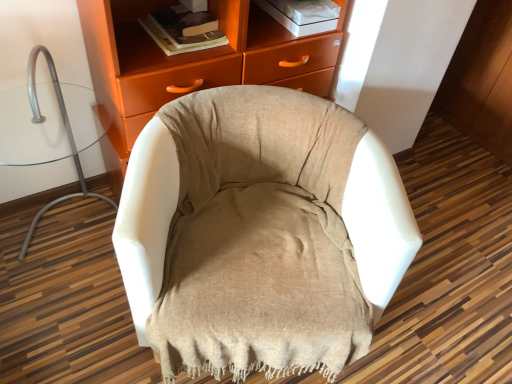
Question: Can you confirm if hardcover book at upper center is positioned to the left of beige fabric chair at center?

Choices:
 (A) no
 (B) yes

Answer: (B)

Question: Can you confirm if hardcover book at upper center is thinner than beige fabric chair at center?

Choices:
 (A) no
 (B) yes

Answer: (B)

Question: From a real-world perspective, is hardcover book at upper center on top of beige fabric chair at center?

Choices:
 (A) no
 (B) yes

Answer: (B)

Question: Is hardcover book at upper center not inside beige fabric chair at center?

Choices:
 (A) no
 (B) yes

Answer: (B)

Question: From a real-world perspective, is hardcover book at upper center physically below beige fabric chair at center?

Choices:
 (A) yes
 (B) no

Answer: (B)

Question: From the image's perspective, is hardcover book at upper center beneath beige fabric chair at center?

Choices:
 (A) no
 (B) yes

Answer: (A)

Question: Does beige fabric chair at center appear on the left side of hardcover book at upper center?

Choices:
 (A) no
 (B) yes

Answer: (A)

Question: Would you say beige fabric chair at center is outside hardcover book at upper center?

Choices:
 (A) yes
 (B) no

Answer: (A)

Question: From the image's perspective, is beige fabric chair at center beneath hardcover book at upper center?

Choices:
 (A) yes
 (B) no

Answer: (A)

Question: Can you confirm if beige fabric chair at center is taller than hardcover book at upper center?

Choices:
 (A) yes
 (B) no

Answer: (A)

Question: Can you confirm if beige fabric chair at center is wider than hardcover book at upper center?

Choices:
 (A) yes
 (B) no

Answer: (A)

Question: From a real-world perspective, is beige fabric chair at center located beneath hardcover book at upper center?

Choices:
 (A) yes
 (B) no

Answer: (A)

Question: Can you confirm if white fabric chair at left is wider than matte orange cabinet at upper center?

Choices:
 (A) no
 (B) yes

Answer: (B)